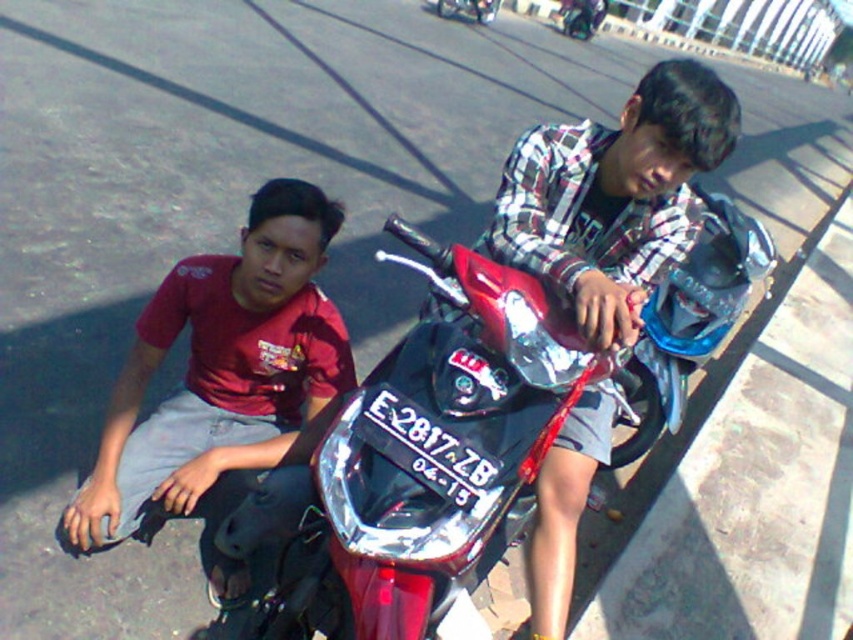
Is shiny metallic motorcycle at center above matte red shirt at left?

Actually, shiny metallic motorcycle at center is below matte red shirt at left.

Is shiny metallic motorcycle at center bigger than matte red shirt at left?

Indeed, shiny metallic motorcycle at center has a larger size compared to matte red shirt at left.

You are a GUI agent. You are given a task and a screenshot of the screen. Output one action in this format:
    pyautogui.click(x=<x>, y=<y>)
    Task: Click on the shiny metallic motorcycle at center
    The width and height of the screenshot is (853, 640).
    Given the screenshot: What is the action you would take?
    pyautogui.click(x=485, y=428)

Which is in front, point (495, 417) or point (616, 138)?

Positioned in front is point (495, 417).

This screenshot has height=640, width=853. What do you see at coordinates (485, 428) in the screenshot?
I see `shiny metallic motorcycle at center` at bounding box center [485, 428].

Locate an element on the screen. The image size is (853, 640). shiny metallic motorcycle at center is located at coordinates click(485, 428).

Can you confirm if matte red shirt at left is thinner than plaid shirt at center?

No, matte red shirt at left is not thinner than plaid shirt at center.

Does matte red shirt at left have a larger size compared to plaid shirt at center?

Indeed, matte red shirt at left has a larger size compared to plaid shirt at center.

This screenshot has height=640, width=853. What do you see at coordinates (227, 387) in the screenshot? I see `matte red shirt at left` at bounding box center [227, 387].

Find the location of a particular element. This screenshot has height=640, width=853. matte red shirt at left is located at coordinates (227, 387).